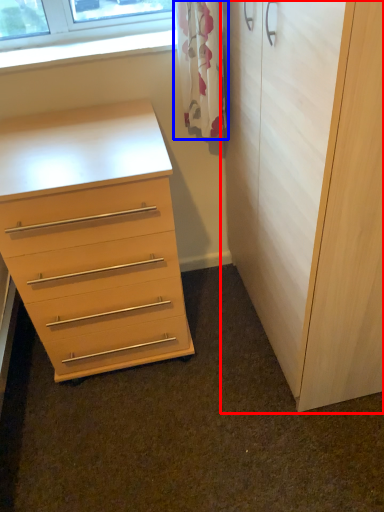
Question: Which point is further to the camera, cupboard (highlighted by a red box) or curtain (highlighted by a blue box)?

Choices:
 (A) cupboard
 (B) curtain

Answer: (B)